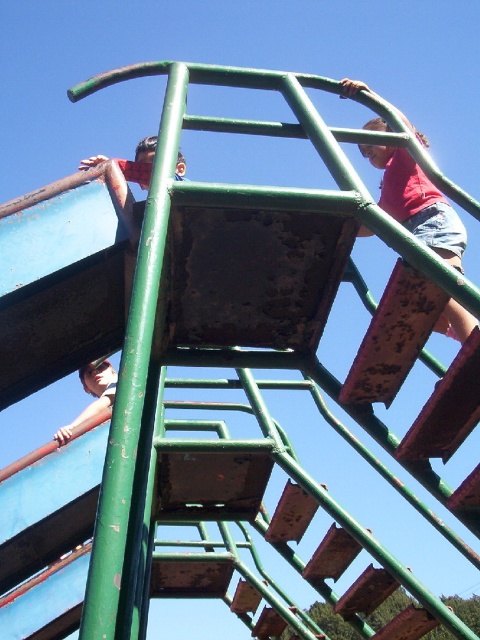
The image size is (480, 640). Find the location of `matte red shirt at upper right`. matte red shirt at upper right is located at coordinates (417, 202).

Is point (387, 164) less distant than point (90, 406)?

Yes, point (387, 164) is in front of point (90, 406).

Does point (388, 157) come closer to viewer compared to point (70, 436)?

No, (388, 157) is behind (70, 436).

Find the location of a particular element. This screenshot has width=480, height=640. matte red shirt at upper right is located at coordinates (417, 202).